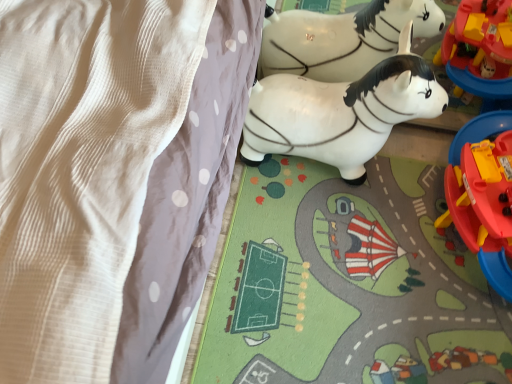
In order to face matte plastic playset at right, the second toy viewed from the left, should I rotate leftwards or rightwards?

You should look right and rotate roughly 30.616 degrees.

Identify the location of matte plastic playset at right, the second toy viewed from the left. (483, 195).

What is the approximate height of white textured blanket at upper left?

white textured blanket at upper left is 36.50 inches tall.

Locate an element on the screen. The width and height of the screenshot is (512, 384). white glossy plastic horse at center, marked as the 1th toy in a left-to-right arrangement is located at coordinates 340,112.

Considering the sizes of objects white glossy plastic horse at center, marked as the 1th toy in a left-to-right arrangement, and matte plastic playset at right, the second toy viewed from the left, in the image provided, who is bigger, white glossy plastic horse at center, marked as the 1th toy in a left-to-right arrangement, or matte plastic playset at right, the second toy viewed from the left,?

With larger size is matte plastic playset at right, the second toy viewed from the left.

What's the angular difference between white glossy plastic horse at center, which is the second toy in right-to-left order, and matte plastic playset at right, which ranks as the first toy in right-to-left order,'s facing directions?

white glossy plastic horse at center, which is the second toy in right-to-left order, and matte plastic playset at right, which ranks as the first toy in right-to-left order, are facing 90 degrees away from each other.

Is white glossy plastic horse at center, marked as the 1th toy in a left-to-right arrangement, positioned far away from matte plastic playset at right, the second toy viewed from the left?

No, white glossy plastic horse at center, marked as the 1th toy in a left-to-right arrangement, is not far from matte plastic playset at right, the second toy viewed from the left.

I want to click on toy that appears on the right of white glossy plastic horse at center, which is the second toy in right-to-left order, so click(483, 195).

From the image's perspective, between white glossy plastic horse at center, which is the second toy in right-to-left order, and white textured blanket at upper left, which one is located above?

white textured blanket at upper left appears higher in the image.

From a real-world perspective, who is located higher, white glossy plastic horse at center, marked as the 1th toy in a left-to-right arrangement, or white textured blanket at upper left?

white textured blanket at upper left, from a real-world perspective.

Is white glossy plastic horse at center, marked as the 1th toy in a left-to-right arrangement, spatially inside white textured blanket at upper left, or outside of it?

white glossy plastic horse at center, marked as the 1th toy in a left-to-right arrangement, exists outside the volume of white textured blanket at upper left.

Find the location of a particular element. The image size is (512, 384). blanket on the left of the white glossy plastic horse at center, marked as the 1th toy in a left-to-right arrangement is located at coordinates (81, 168).

Is matte plastic playset at right, which ranks as the first toy in right-to-left order, positioned beyond the bounds of white textured blanket at upper left?

Absolutely, matte plastic playset at right, which ranks as the first toy in right-to-left order, is external to white textured blanket at upper left.

From a real-world perspective, which is physically above, matte plastic playset at right, which ranks as the first toy in right-to-left order, or white textured blanket at upper left?

In real-world perspective, white textured blanket at upper left is above.

Is matte plastic playset at right, the second toy viewed from the left, bigger than white textured blanket at upper left?

No, matte plastic playset at right, the second toy viewed from the left, is not bigger than white textured blanket at upper left.

From the white textured blanket at upper left, count 2nd toy to the right and point to it. Please provide its 2D coordinates.

[(483, 195)]

Measure the distance between matte plastic playset at right, which ranks as the first toy in right-to-left order, and white glossy plastic horse at center, which is the second toy in right-to-left order.

matte plastic playset at right, which ranks as the first toy in right-to-left order, is 14.28 inches away from white glossy plastic horse at center, which is the second toy in right-to-left order.

Is matte plastic playset at right, which ranks as the first toy in right-to-left order, facing away from white glossy plastic horse at center, marked as the 1th toy in a left-to-right arrangement?

matte plastic playset at right, which ranks as the first toy in right-to-left order, is not turned away from white glossy plastic horse at center, marked as the 1th toy in a left-to-right arrangement.

From a real-world perspective, relative to white glossy plastic horse at center, marked as the 1th toy in a left-to-right arrangement, is matte plastic playset at right, the second toy viewed from the left, vertically above or below?

In terms of real-world spatial position, matte plastic playset at right, the second toy viewed from the left, is below white glossy plastic horse at center, marked as the 1th toy in a left-to-right arrangement.

How different are the orientations of matte plastic playset at right, which ranks as the first toy in right-to-left order, and white glossy plastic horse at center, marked as the 1th toy in a left-to-right arrangement, in degrees?

The facing directions of matte plastic playset at right, which ranks as the first toy in right-to-left order, and white glossy plastic horse at center, marked as the 1th toy in a left-to-right arrangement, are 90 degrees apart.

Is white textured blanket at upper left positioned far away from white glossy plastic horse at center, marked as the 1th toy in a left-to-right arrangement?

That's not correct — white textured blanket at upper left is a little close to white glossy plastic horse at center, marked as the 1th toy in a left-to-right arrangement.

What's the angular difference between white textured blanket at upper left and white glossy plastic horse at center, which is the second toy in right-to-left order,'s facing directions?

90.2 degrees separate the facing orientations of white textured blanket at upper left and white glossy plastic horse at center, which is the second toy in right-to-left order.

Is white textured blanket at upper left looking in the opposite direction of white glossy plastic horse at center, which is the second toy in right-to-left order?

white textured blanket at upper left does not have its back to white glossy plastic horse at center, which is the second toy in right-to-left order.

Is white textured blanket at upper left directly adjacent to matte plastic playset at right, the second toy viewed from the left?

No, white textured blanket at upper left is not making contact with matte plastic playset at right, the second toy viewed from the left.

Is white textured blanket at upper left facing towards matte plastic playset at right, which ranks as the first toy in right-to-left order?

No.

Which of these two, white textured blanket at upper left or matte plastic playset at right, which ranks as the first toy in right-to-left order, stands shorter?

matte plastic playset at right, which ranks as the first toy in right-to-left order, is shorter.

Considering the relative positions of white textured blanket at upper left and matte plastic playset at right, the second toy viewed from the left, in the image provided, is white textured blanket at upper left behind matte plastic playset at right, the second toy viewed from the left,?

That is False.

Locate an element on the screen. This screenshot has width=512, height=384. toy above the matte plastic playset at right, the second toy viewed from the left (from a real-world perspective) is located at coordinates [340, 112].

This screenshot has width=512, height=384. Find the location of `toy that is the 2nd object located behind the white textured blanket at upper left`. toy that is the 2nd object located behind the white textured blanket at upper left is located at coordinates (340, 112).

Looking at this image, based on their spatial positions, is white textured blanket at upper left or matte plastic playset at right, which ranks as the first toy in right-to-left order, closer to white glossy plastic horse at center, which is the second toy in right-to-left order?

matte plastic playset at right, which ranks as the first toy in right-to-left order, is closer to white glossy plastic horse at center, which is the second toy in right-to-left order.

Based on their spatial positions, is white textured blanket at upper left or white glossy plastic horse at center, marked as the 1th toy in a left-to-right arrangement, further from matte plastic playset at right, which ranks as the first toy in right-to-left order?

white textured blanket at upper left lies further to matte plastic playset at right, which ranks as the first toy in right-to-left order, than the other object.

From the picture: From the image, which object appears to be farther from white textured blanket at upper left, matte plastic playset at right, the second toy viewed from the left, or white glossy plastic horse at center, marked as the 1th toy in a left-to-right arrangement?

matte plastic playset at right, the second toy viewed from the left, is further to white textured blanket at upper left.

Looking at the image, which one is located further to white textured blanket at upper left, white glossy plastic horse at center, which is the second toy in right-to-left order, or matte plastic playset at right, which ranks as the first toy in right-to-left order?

matte plastic playset at right, which ranks as the first toy in right-to-left order, is further to white textured blanket at upper left.

When comparing their distances from white glossy plastic horse at center, marked as the 1th toy in a left-to-right arrangement, does matte plastic playset at right, the second toy viewed from the left, or white textured blanket at upper left seem further?

white textured blanket at upper left is positioned further to the anchor white glossy plastic horse at center, marked as the 1th toy in a left-to-right arrangement.

From the image, which object appears to be nearer to matte plastic playset at right, the second toy viewed from the left, white glossy plastic horse at center, which is the second toy in right-to-left order, or white textured blanket at upper left?

white glossy plastic horse at center, which is the second toy in right-to-left order, is positioned closer to the anchor matte plastic playset at right, the second toy viewed from the left.

Where is `toy between white textured blanket at upper left and matte plastic playset at right, the second toy viewed from the left, in the horizontal direction`? The width and height of the screenshot is (512, 384). toy between white textured blanket at upper left and matte plastic playset at right, the second toy viewed from the left, in the horizontal direction is located at coordinates (340, 112).